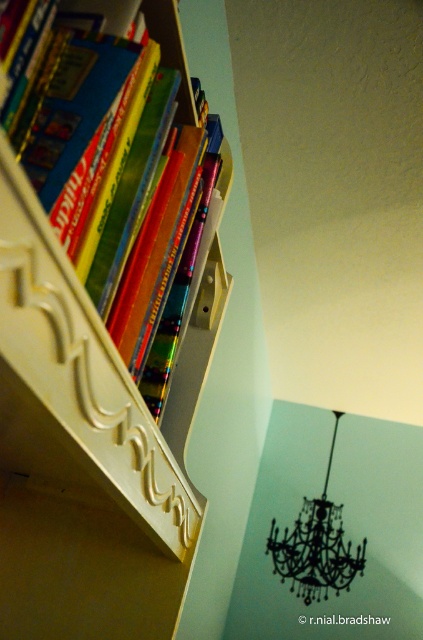
Question: Which of the following is the closest to the observer?

Choices:
 (A) matte blue book at left
 (B) white carved wood drawer at upper left
 (C) black crystal chandelier at upper center

Answer: (B)

Question: Among these objects, which one is nearest to the camera?

Choices:
 (A) matte blue book at left
 (B) white carved wood drawer at upper left
 (C) black crystal chandelier at upper center

Answer: (B)

Question: Observing the image, what is the correct spatial positioning of matte blue book at left in reference to black crystal chandelier at upper center?

Choices:
 (A) left
 (B) right

Answer: (A)

Question: Which of the following is the closest to the observer?

Choices:
 (A) white carved wood drawer at upper left
 (B) black crystal chandelier at upper center

Answer: (A)

Question: In this image, where is matte blue book at left located relative to white carved wood drawer at upper left?

Choices:
 (A) left
 (B) right

Answer: (B)

Question: Does matte blue book at left appear under white carved wood drawer at upper left?

Choices:
 (A) no
 (B) yes

Answer: (A)